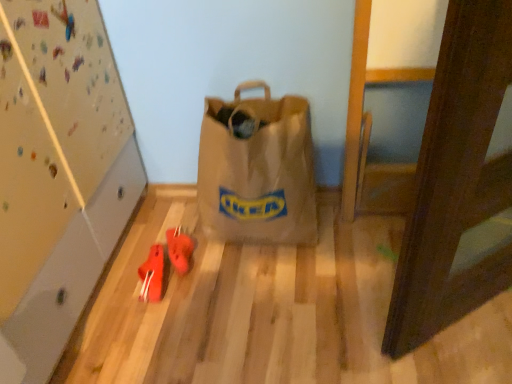
Identify the location of vacant space to the right of rubberized red shoes at lower left, the first footwear when ordered from left to right. (206, 283).